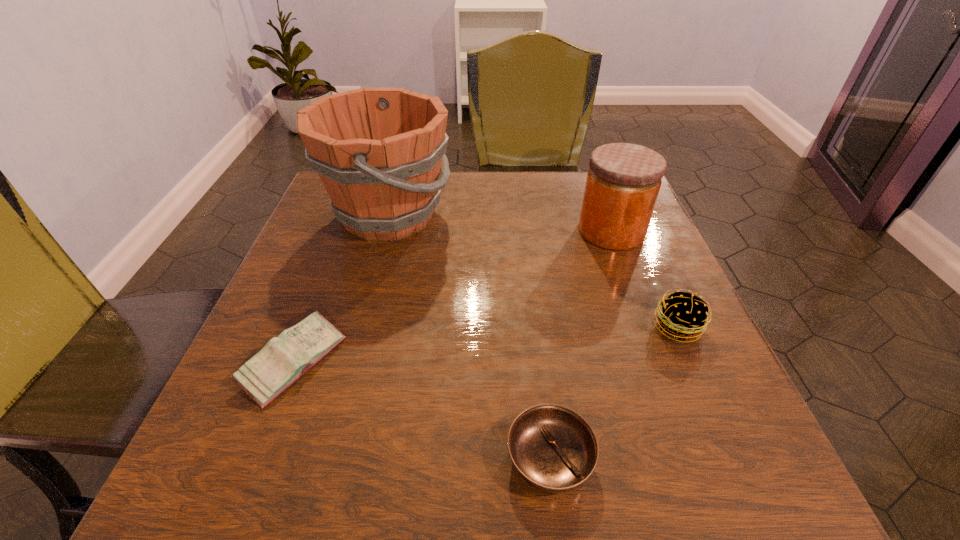
In the image, there is a desktop. Find the location of `vacant region at the far edge`. vacant region at the far edge is located at coordinates (459, 187).

Locate an element on the screen. free space at the near edge of the desktop is located at coordinates (601, 482).

Image resolution: width=960 pixels, height=540 pixels. I want to click on vacant space at the left edge of the desktop, so click(x=331, y=247).

Image resolution: width=960 pixels, height=540 pixels. Identify the location of blank space at the right edge of the desktop. (696, 372).

Image resolution: width=960 pixels, height=540 pixels. What are the coordinates of `vacant space at the far left corner` in the screenshot? It's located at (326, 222).

The height and width of the screenshot is (540, 960). Identify the location of vacant area at the near right corner. pyautogui.click(x=766, y=467).

This screenshot has width=960, height=540. What are the coordinates of `free space between the bucket and the nearest object` in the screenshot? It's located at (469, 336).

What are the coordinates of `free space between the fourth shortest object and the nearest object` in the screenshot? It's located at (581, 345).

Locate an element on the screen. This screenshot has height=540, width=960. vacant point located between the second tallest object and the second shortest object is located at coordinates (452, 296).

Image resolution: width=960 pixels, height=540 pixels. I want to click on free space between the soup bowl and the bucket, so click(469, 336).